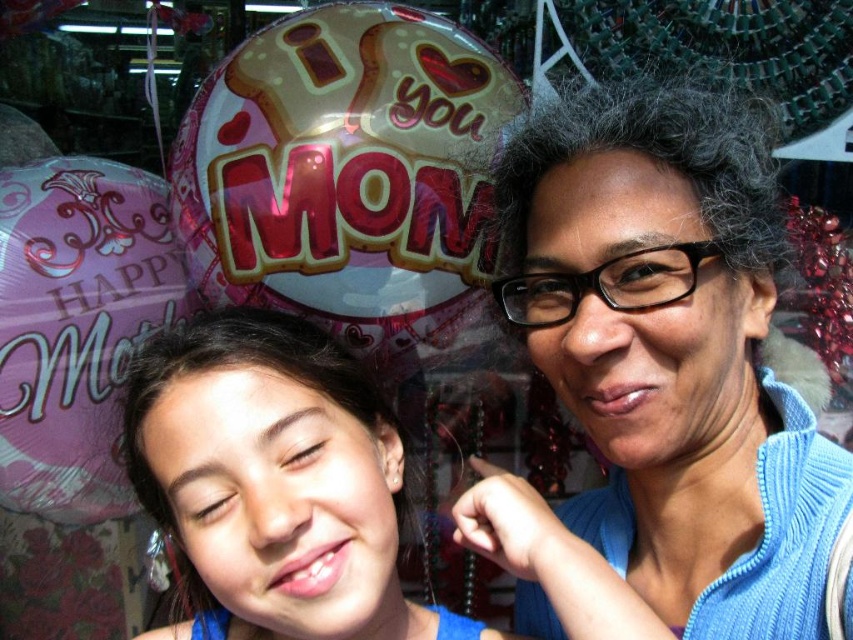
Is blue knitted sweater at center to the left of pink metallic balloon at upper center from the viewer's perspective?

No, blue knitted sweater at center is not to the left of pink metallic balloon at upper center.

Is blue knitted sweater at center positioned behind pink metallic balloon at upper center?

No, it is in front of pink metallic balloon at upper center.

Which is behind, point (622, 388) or point (347, 205)?

Point (347, 205)

Locate an element on the screen. The height and width of the screenshot is (640, 853). blue knitted sweater at center is located at coordinates (672, 353).

Is point (712, 435) positioned in front of point (167, 355)?

That is False.

Identify the location of blue knitted sweater at center. The image size is (853, 640). (672, 353).

Is point (593, 305) farther from viewer compared to point (331, 588)?

Yes, it is.

Find the location of a particular element. Image resolution: width=853 pixels, height=640 pixels. blue knitted sweater at center is located at coordinates (672, 353).

Does smooth blue shirt at center lie behind pink metallic balloon at left?

No, smooth blue shirt at center is closer to the viewer.

You are a GUI agent. You are given a task and a screenshot of the screen. Output one action in this format:
    pyautogui.click(x=<x>, y=<y>)
    Task: Click on the smooth blue shirt at center
    
    Given the screenshot: What is the action you would take?
    pyautogui.click(x=276, y=483)

I want to click on smooth blue shirt at center, so click(276, 483).